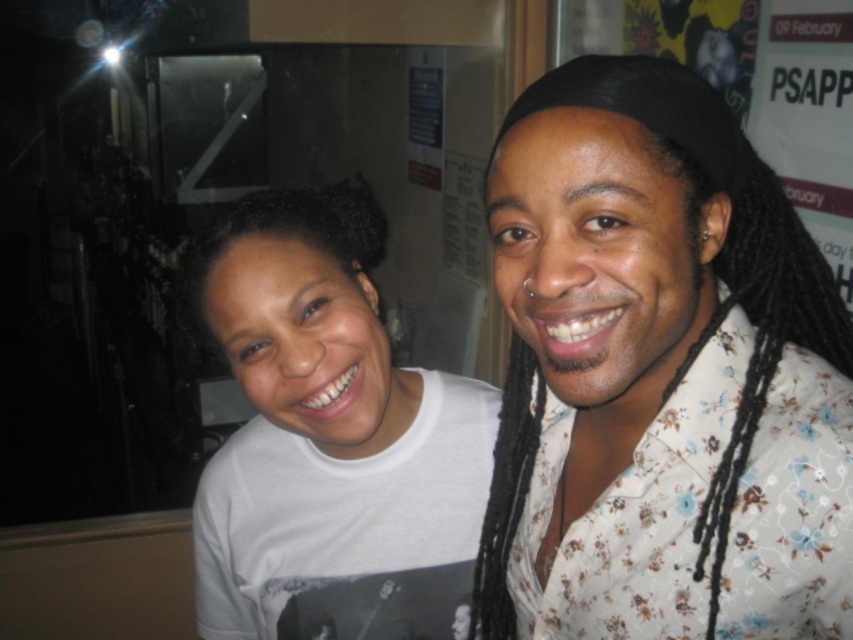
Question: Which point is closer to the camera?

Choices:
 (A) (692, 216)
 (B) (241, 204)

Answer: (A)

Question: Considering the relative positions of floral print shirt at right and black curly hair at upper left in the image provided, where is floral print shirt at right located with respect to black curly hair at upper left?

Choices:
 (A) left
 (B) right

Answer: (B)

Question: Can you confirm if floral print shirt at right is positioned to the left of black curly hair at upper left?

Choices:
 (A) yes
 (B) no

Answer: (B)

Question: Which point is closer to the camera?

Choices:
 (A) black curly hair at upper left
 (B) floral print shirt at right
 (C) white matte t-shirt at center

Answer: (B)

Question: Which point is closer to the camera?

Choices:
 (A) white matte t-shirt at center
 (B) floral print shirt at right
 (C) black curly hair at upper left

Answer: (B)

Question: Is floral print shirt at right above black curly hair at upper left?

Choices:
 (A) yes
 (B) no

Answer: (B)